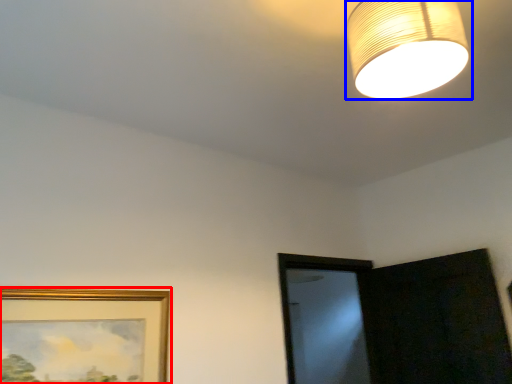
Question: Which object appears farthest to the camera in this image, picture frame (highlighted by a red box) or lamp (highlighted by a blue box)?

Choices:
 (A) picture frame
 (B) lamp

Answer: (A)